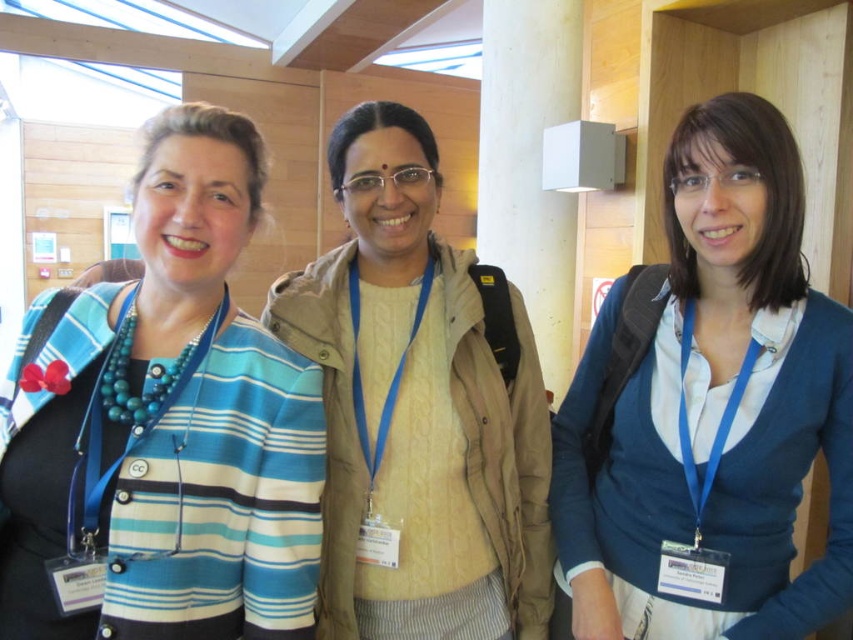
Who is higher up, blue striped cardigan at left or beige woolen sweater at center?

Positioned higher is blue striped cardigan at left.

Find the location of `blue striped cardigan at left`. blue striped cardigan at left is located at coordinates (164, 428).

Can you confirm if blue matte sweater at center is thinner than white matte wall at upper center?

In fact, blue matte sweater at center might be wider than white matte wall at upper center.

Can you confirm if blue matte sweater at center is positioned to the right of white matte wall at upper center?

Correct, you'll find blue matte sweater at center to the right of white matte wall at upper center.

Does point (720, 225) lie in front of point (518, 161)?

Yes, point (720, 225) is closer to viewer.

The width and height of the screenshot is (853, 640). What are the coordinates of `blue matte sweater at center` in the screenshot? It's located at (709, 412).

Is point (267, 636) closer to viewer compared to point (614, 353)?

That is True.

Is blue striped cardigan at left taller than blue matte sweater at center?

No.

Does point (292, 588) lie in front of point (698, 266)?

That is True.

Image resolution: width=853 pixels, height=640 pixels. In order to click on blue striped cardigan at left in this screenshot , I will do `click(164, 428)`.